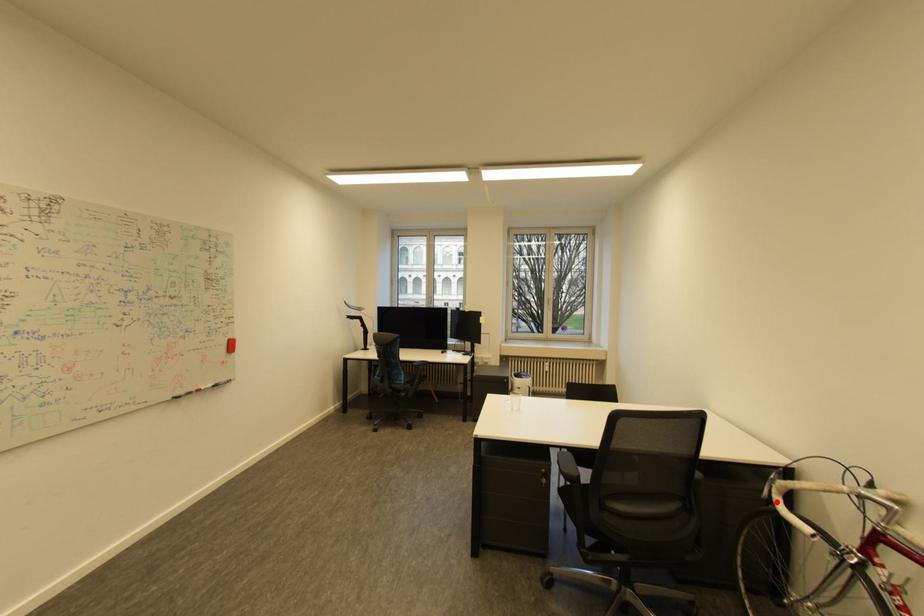
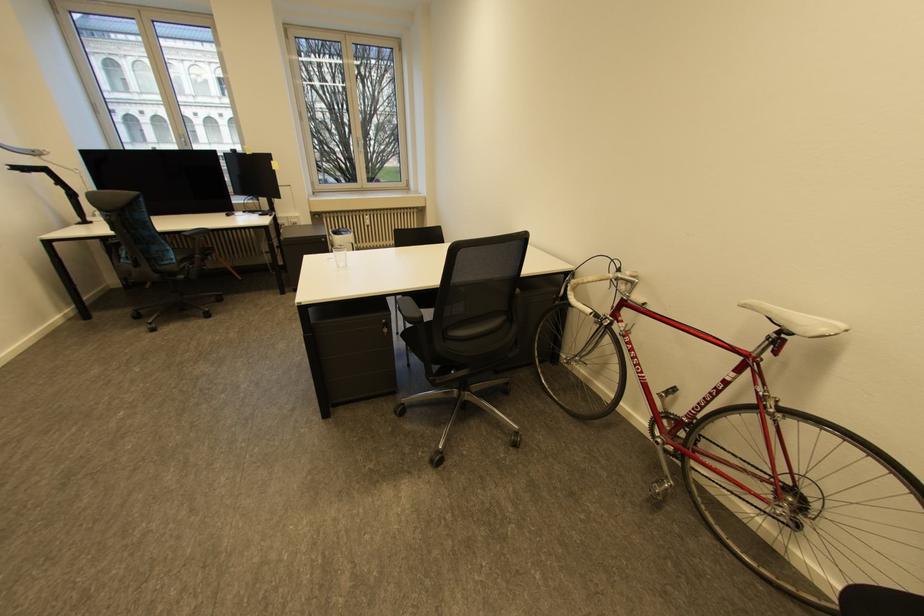
Where in the second image is the point corresponding to the highlighted location from the first image?

(572, 299)